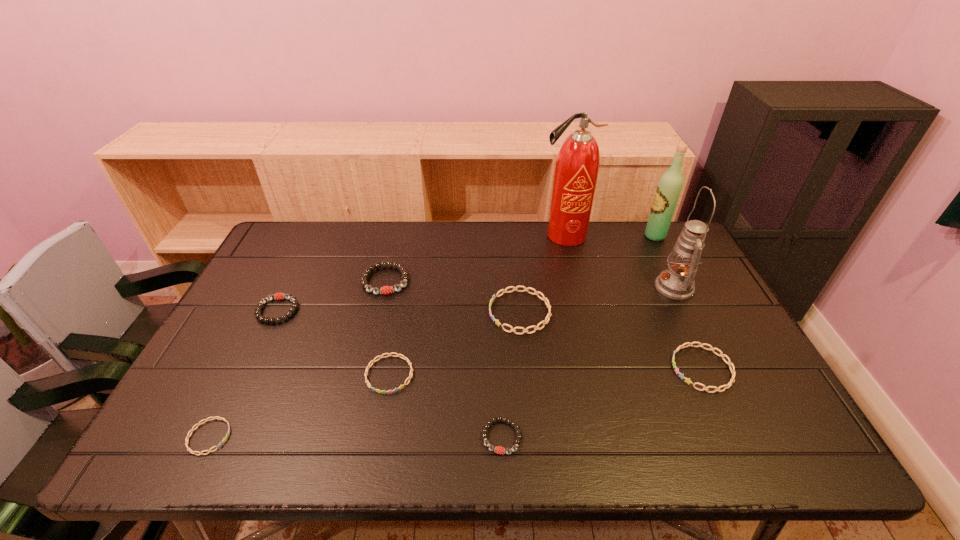
Where is `vacant area that satisfies the following two spatial constraints: 1. on the back side of the nearest black bracelet; 2. on the surface of the smallest blue bracelet showing star-shaped elements`? This screenshot has width=960, height=540. vacant area that satisfies the following two spatial constraints: 1. on the back side of the nearest black bracelet; 2. on the surface of the smallest blue bracelet showing star-shaped elements is located at coordinates (502, 437).

Where is `free spot that satisfies the following two spatial constraints: 1. on the surface of the smallest blue bracelet showing star-shaped elements; 2. on the back side of the nearest black bracelet`? The image size is (960, 540). free spot that satisfies the following two spatial constraints: 1. on the surface of the smallest blue bracelet showing star-shaped elements; 2. on the back side of the nearest black bracelet is located at coordinates (209, 437).